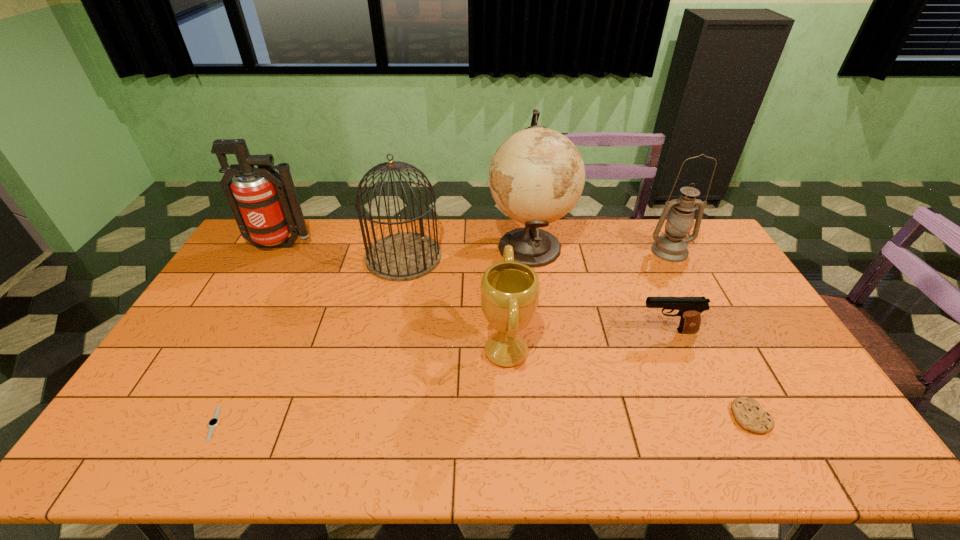
Identify the location of vacant region located on the front-facing side of the globe. (439, 246).

The height and width of the screenshot is (540, 960). In order to click on free space located 0.100m on the front label side of the fire extinguisher in this screenshot , I will do `click(264, 275)`.

I want to click on free space located at the door of the sixth object from right to left, so click(x=512, y=256).

This screenshot has width=960, height=540. In order to click on vacant region located 0.100m on the back of the oil lamp in this screenshot , I will do `click(656, 226)`.

What are the coordinates of `free space located 0.320m on the front of the fourth shortest object with the decoration` in the screenshot? It's located at (368, 352).

At what (x,y) coordinates should I click in order to perform the action: click on free point located 0.310m on the front of the fourth shortest object with the decoration. Please return your answer as a coordinate pair (x, y). Looking at the image, I should click on (372, 352).

Where is `vacant space located on the front of the fourth shortest object with the decoration`? vacant space located on the front of the fourth shortest object with the decoration is located at coordinates (393, 352).

You are a GUI agent. You are given a task and a screenshot of the screen. Output one action in this format:
    pyautogui.click(x=<x>, y=<y>)
    Task: Click on the vacant space located 0.140m at the barrel of the third shortest object
    The height and width of the screenshot is (540, 960).
    Given the screenshot: What is the action you would take?
    pyautogui.click(x=590, y=331)

Locate an element on the screen. This screenshot has height=540, width=960. free space located 0.150m at the barrel of the third shortest object is located at coordinates (x=587, y=331).

Where is `vacant position located 0.160m at the barrel of the third shortest object`? The image size is (960, 540). vacant position located 0.160m at the barrel of the third shortest object is located at coordinates (584, 331).